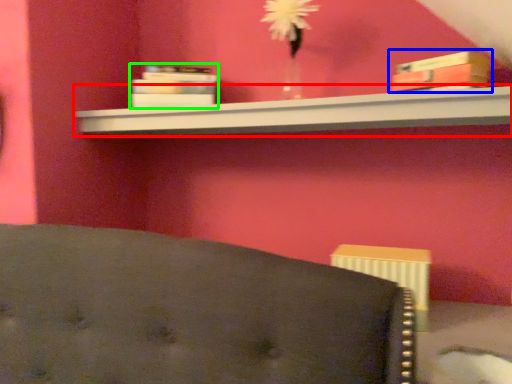
Question: Estimate the real-world distances between objects in this image. Which object is closer to shelf (highlighted by a red box), book (highlighted by a blue box) or book (highlighted by a green box)?

Choices:
 (A) book
 (B) book

Answer: (B)